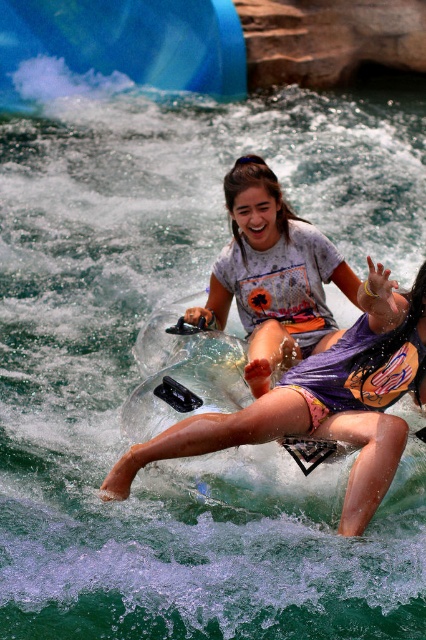
You are navigating a tube ride at a water park and see two points marked on your path. The first point is at point (244, 291) and the second is at point (210, 33). Which point will you encounter first as you move forward?

Point (244, 291) will be encountered first because it is positioned in front of point (210, 33) along your path.